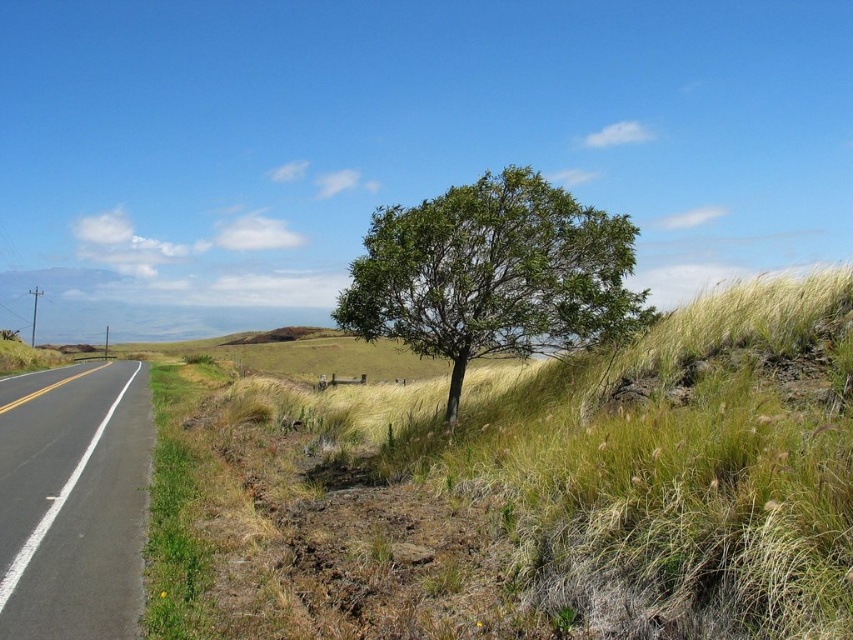
Question: Is green leafy tree at center smaller than black asphalt road at left?

Choices:
 (A) yes
 (B) no

Answer: (A)

Question: Does green leafy tree at center have a greater width compared to black asphalt road at left?

Choices:
 (A) yes
 (B) no

Answer: (B)

Question: Observing the image, what is the correct spatial positioning of green leafy tree at center in reference to black asphalt road at left?

Choices:
 (A) above
 (B) below

Answer: (A)

Question: Which object appears farthest from the camera in this image?

Choices:
 (A) black asphalt road at left
 (B) green leafy tree at center

Answer: (B)

Question: Which point is closer to the camera?

Choices:
 (A) [477, 346]
 (B) [24, 556]

Answer: (B)